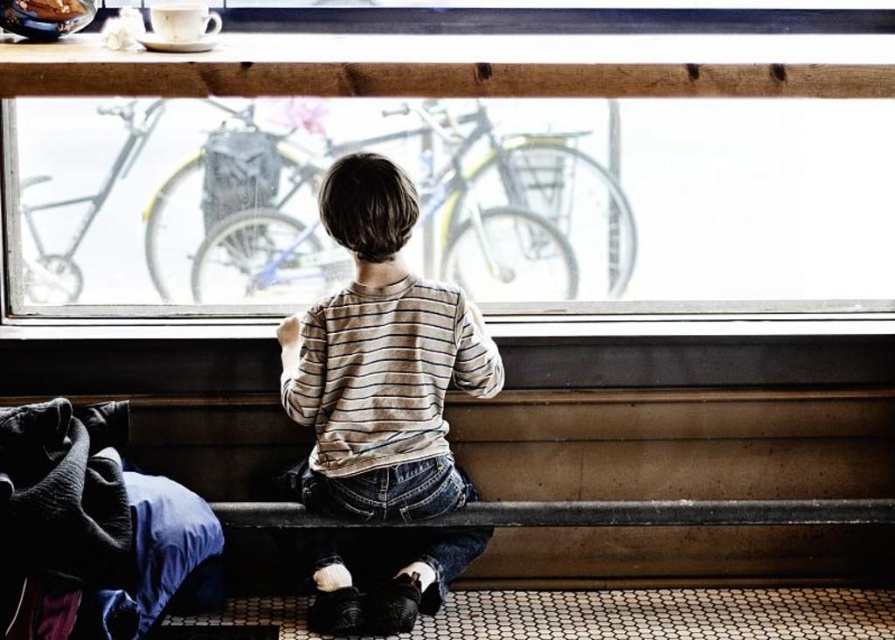
Question: Does smooth wooden bench at center have a smaller size compared to velvet-like fabric at lower left?

Choices:
 (A) no
 (B) yes

Answer: (B)

Question: Which object is positioned closest to the striped cotton shirt at center?

Choices:
 (A) clear glass window at center
 (B) velvet-like fabric at lower left

Answer: (B)

Question: Which point is closer to the camera?

Choices:
 (A) clear glass window at center
 (B) velvet-like fabric at lower left
 (C) smooth wooden bench at center

Answer: (B)

Question: Is striped cotton shirt at center smaller than velvet-like fabric at lower left?

Choices:
 (A) no
 (B) yes

Answer: (A)

Question: Does clear glass window at center have a larger size compared to striped cotton shirt at center?

Choices:
 (A) yes
 (B) no

Answer: (A)

Question: Which point is farther to the camera?

Choices:
 (A) (345, 374)
 (B) (533, 442)

Answer: (B)